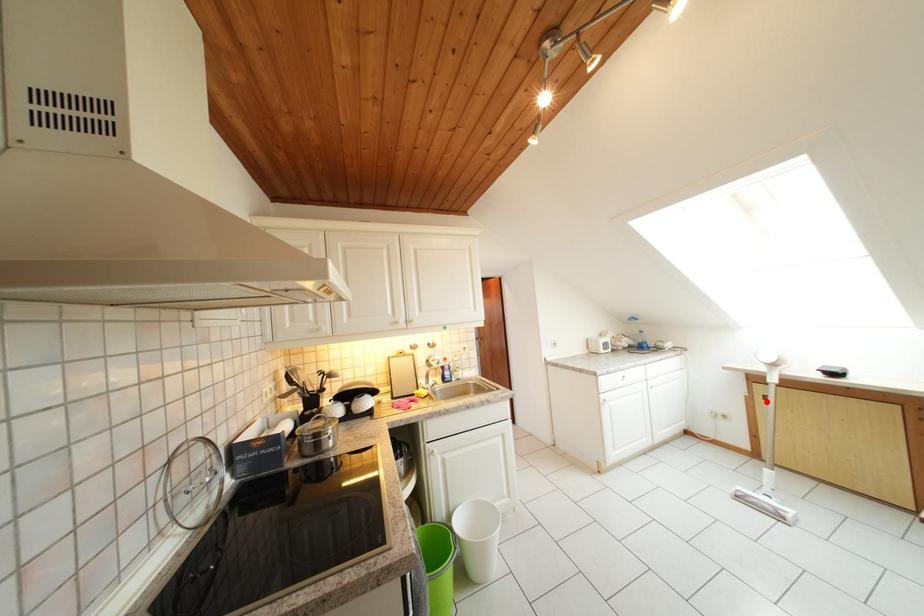
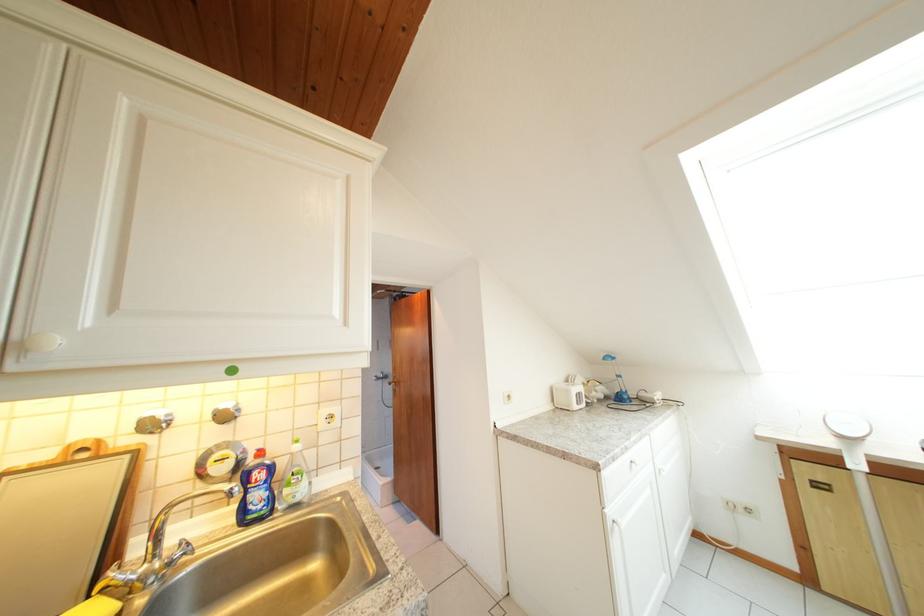
Find the pixel in the second image that matches the highlighted location in the first image.

(810, 487)